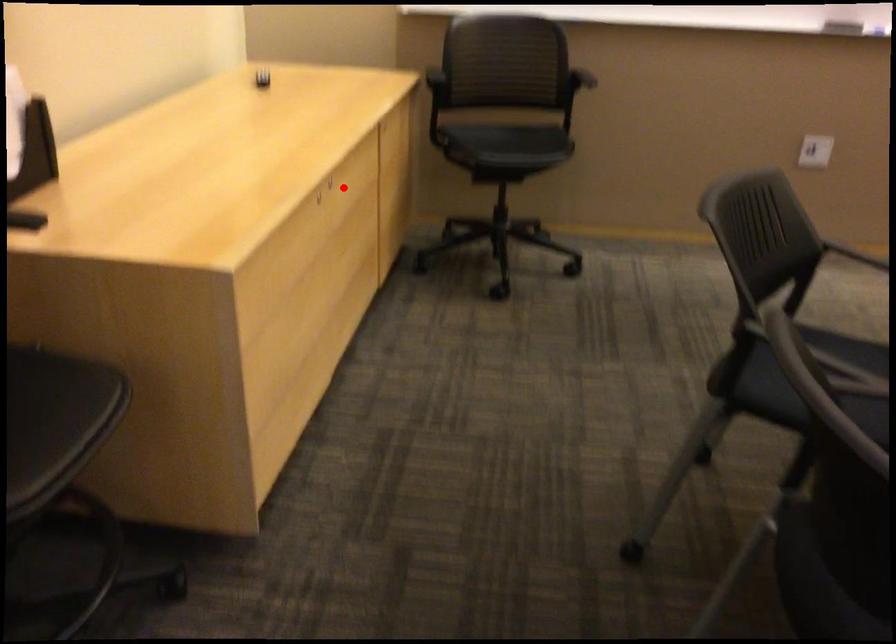
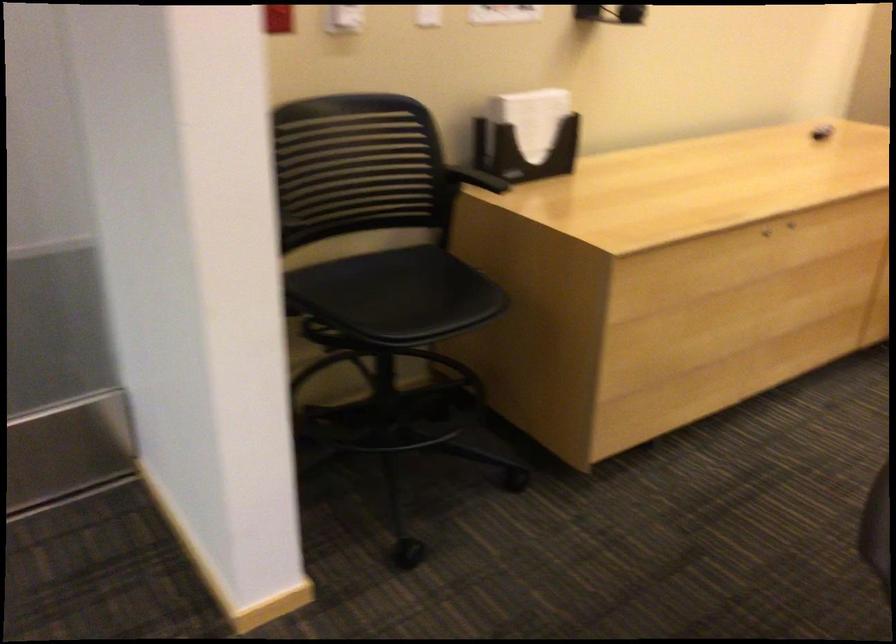
Question: I am providing you with two images of the same scene from different viewpoints. In image1, a red point is highlighted. Considering the same 3D point in image2, which of the following is correct?

Choices:
 (A) It is closer
 (B) It is farther

Answer: (B)